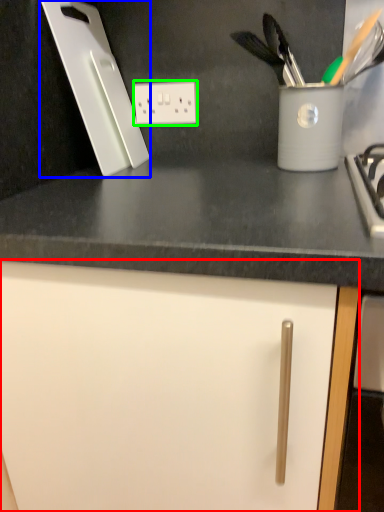
Question: Which object is positioned closest to cabinetry (highlighted by a red box)? Select from kitchen appliance (highlighted by a blue box) and electric outlet (highlighted by a green box).

Choices:
 (A) kitchen appliance
 (B) electric outlet

Answer: (A)